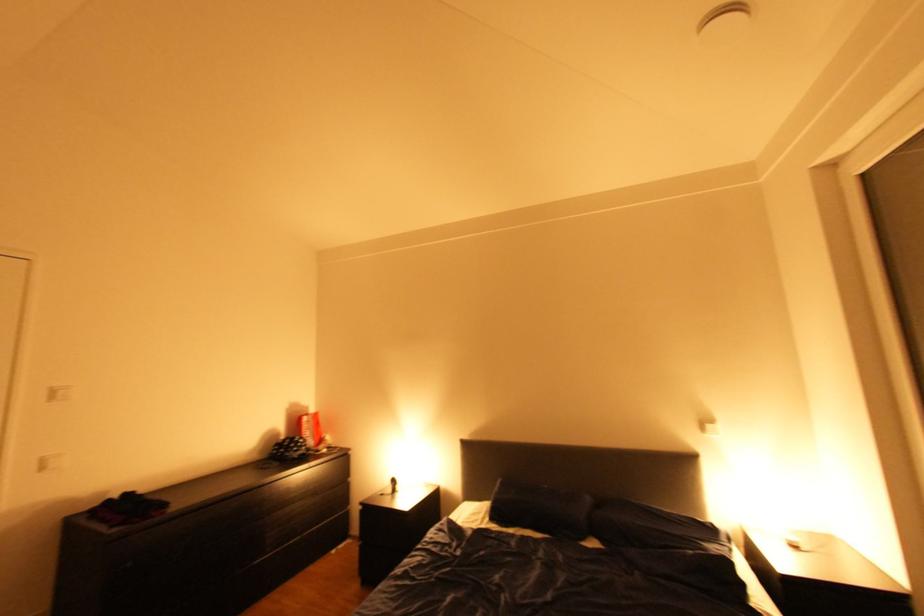
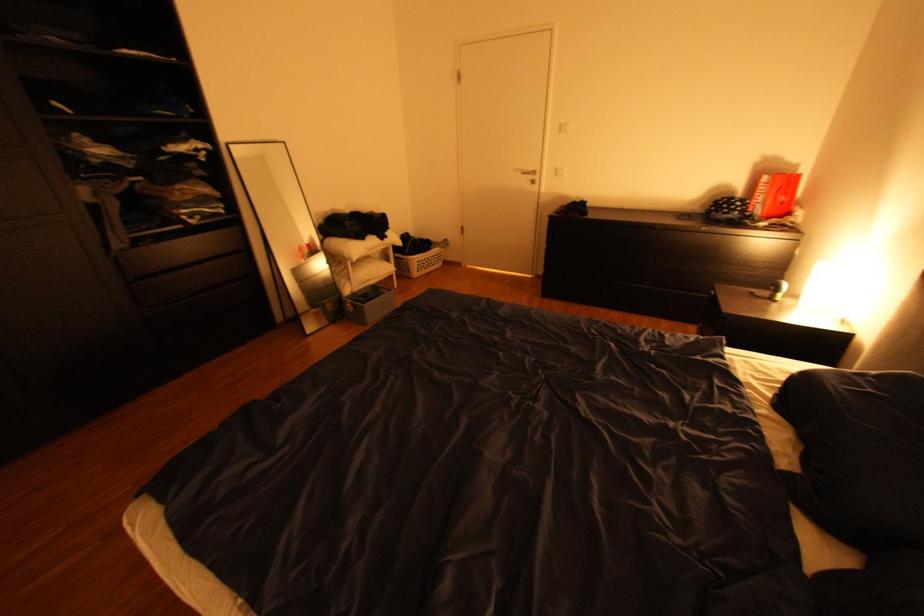
Locate, in the second image, the point that corresponds to (x=312, y=444) in the first image.

(748, 208)